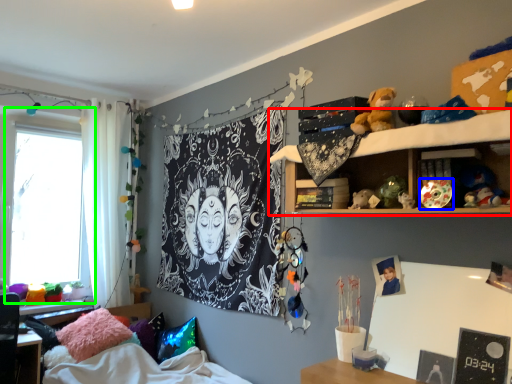
Question: Which object is positioned closest to shelf (highlighted by a red box)? Select from toy (highlighted by a blue box) and window (highlighted by a green box).

Choices:
 (A) toy
 (B) window

Answer: (A)